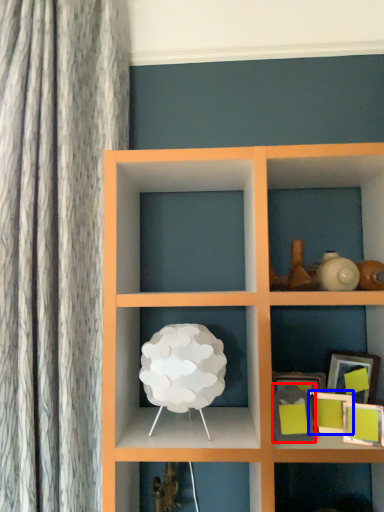
Question: Which object is further to the camera taking this photo, picture frame (highlighted by a red box) or picture frame (highlighted by a blue box)?

Choices:
 (A) picture frame
 (B) picture frame

Answer: (B)